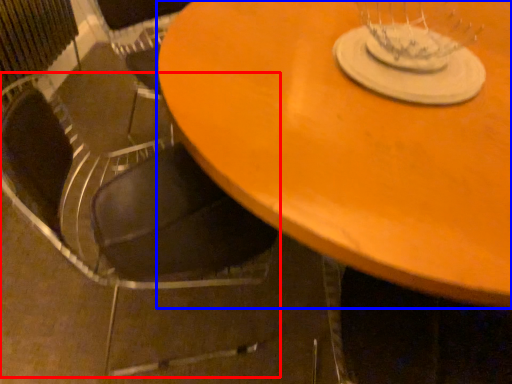
Question: Which of the following is the farthest to the observer, chair (highlighted by a red box) or table (highlighted by a blue box)?

Choices:
 (A) chair
 (B) table

Answer: (A)